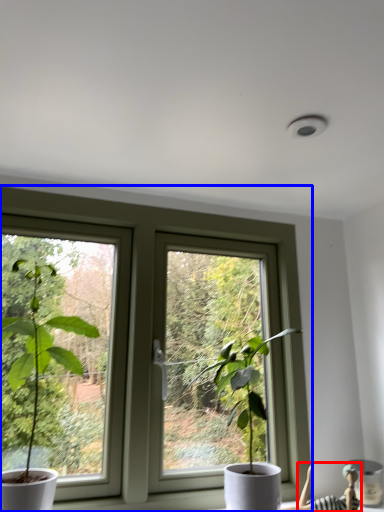
Question: Which of the following is the farthest to the observer, couple (highlighted by a red box) or window (highlighted by a blue box)?

Choices:
 (A) couple
 (B) window

Answer: (A)